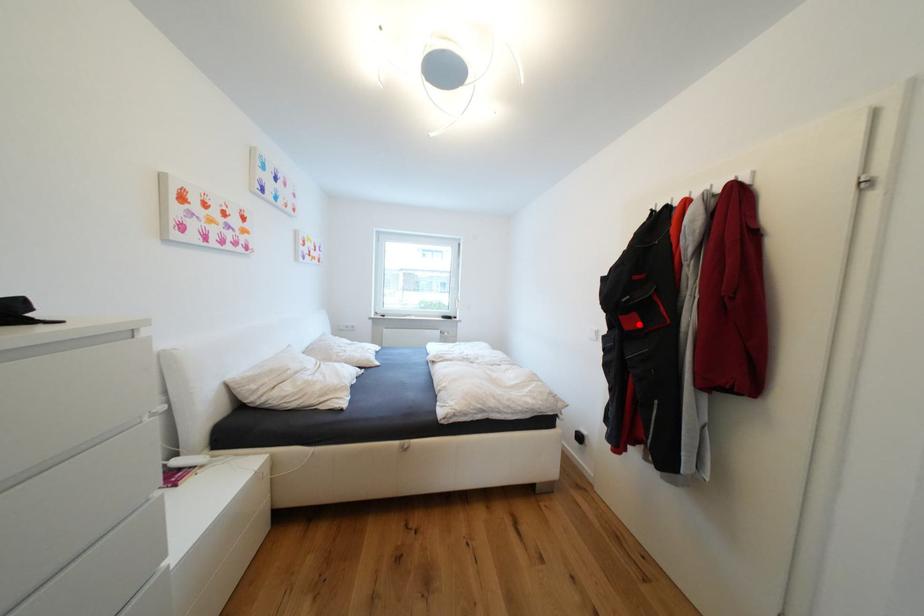
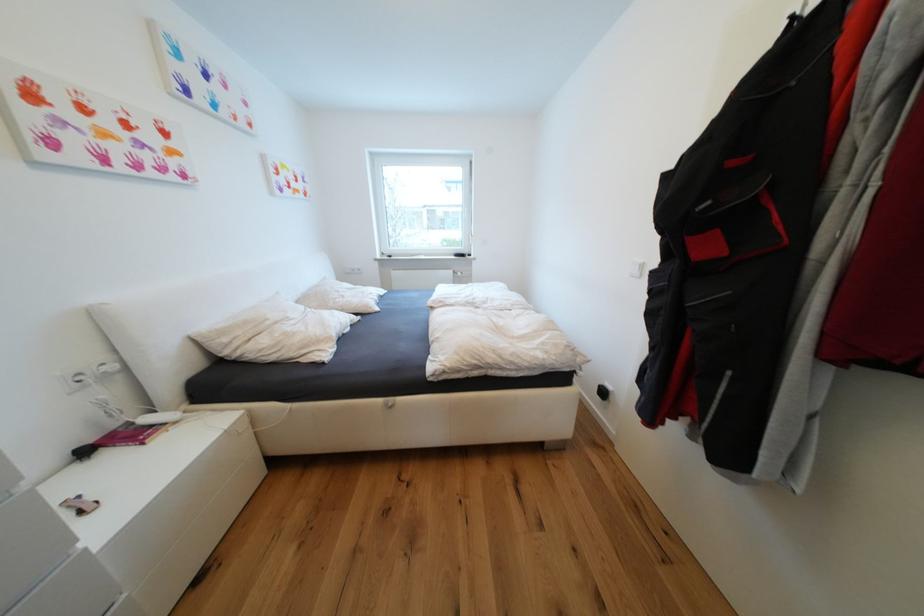
Find the pixel in the second image that matches the highlighted location in the first image.

(714, 249)